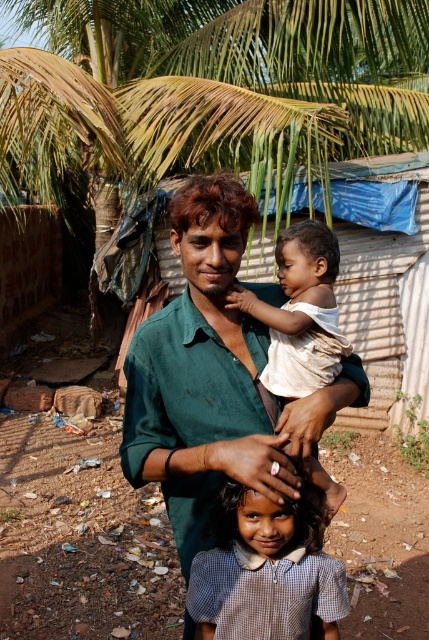
Question: Among these objects, which one is farthest from the camera?

Choices:
 (A) green cotton shirt at center
 (B) light blue checkered shirt at center

Answer: (B)

Question: Is green cotton shirt at center above white cotton shirt at center?

Choices:
 (A) yes
 (B) no

Answer: (B)

Question: Does green cotton shirt at center lie behind light blue checkered shirt at center?

Choices:
 (A) yes
 (B) no

Answer: (B)

Question: Among these points, which one is farthest from the camera?

Choices:
 (A) (204, 266)
 (B) (263, 317)
 (C) (271, 589)

Answer: (B)

Question: Which point is closer to the camera?

Choices:
 (A) (196, 595)
 (B) (141, 465)

Answer: (B)

Question: Is light blue checkered shirt at center above white cotton shirt at center?

Choices:
 (A) yes
 (B) no

Answer: (B)